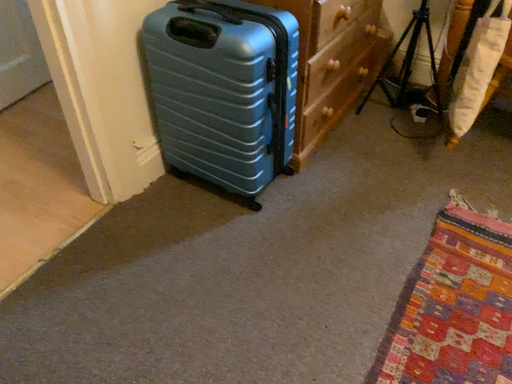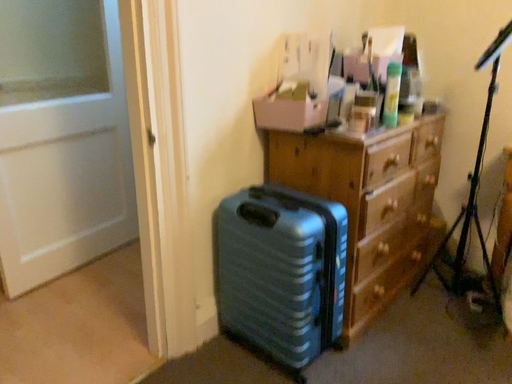
Question: How did the camera likely rotate when shooting the video?

Choices:
 (A) rotated downward
 (B) rotated upward

Answer: (B)